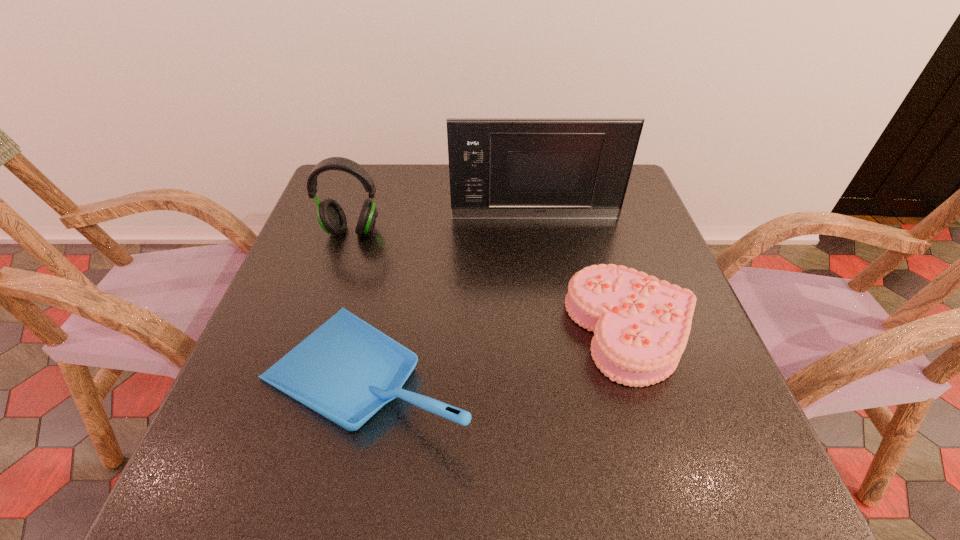
Locate an element on the screen. Image resolution: width=960 pixels, height=540 pixels. object at the near edge is located at coordinates (346, 370).

Find the location of `headset that is at the left edge`. headset that is at the left edge is located at coordinates (330, 215).

Locate an element on the screen. The width and height of the screenshot is (960, 540). dustpan that is positioned at the left edge is located at coordinates (346, 370).

Image resolution: width=960 pixels, height=540 pixels. In order to click on microwave oven located in the right edge section of the desktop in this screenshot , I will do `click(500, 168)`.

Locate an element on the screen. Image resolution: width=960 pixels, height=540 pixels. cake at the right edge is located at coordinates (641, 325).

Find the location of `object located in the near left corner section of the desktop`. object located in the near left corner section of the desktop is located at coordinates (346, 370).

Locate an element on the screen. The image size is (960, 540). vacant area at the far edge is located at coordinates (435, 180).

Where is `vacant space at the left edge of the desktop`? Image resolution: width=960 pixels, height=540 pixels. vacant space at the left edge of the desktop is located at coordinates (296, 246).

In the image, there is a desktop. Find the location of `vacant space at the right edge`. vacant space at the right edge is located at coordinates coord(671,383).

In the image, there is a desktop. Where is `vacant space at the far left corner`? This screenshot has width=960, height=540. vacant space at the far left corner is located at coordinates (370, 166).